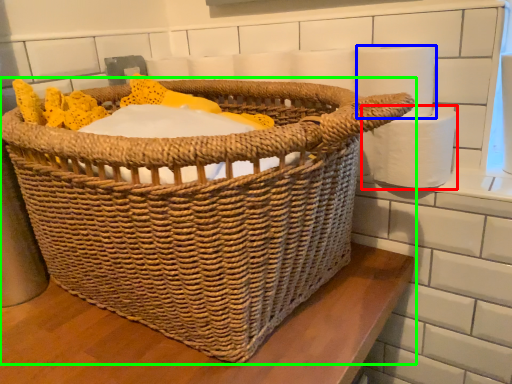
Question: Which object is the farthest from toilet paper (highlighted by a red box)? Choose among these: toilet paper (highlighted by a blue box) or picnic basket (highlighted by a green box).

Choices:
 (A) toilet paper
 (B) picnic basket

Answer: (B)